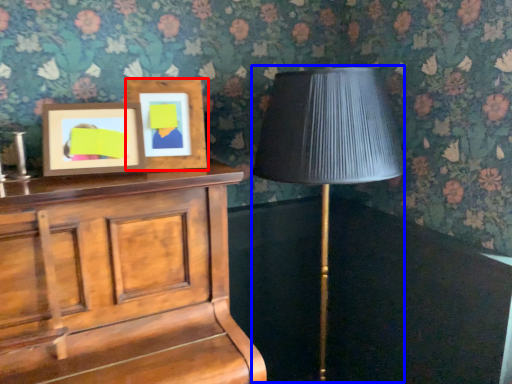
Question: Which object is further to the camera taking this photo, picture frame (highlighted by a red box) or table lamp (highlighted by a blue box)?

Choices:
 (A) picture frame
 (B) table lamp

Answer: (A)